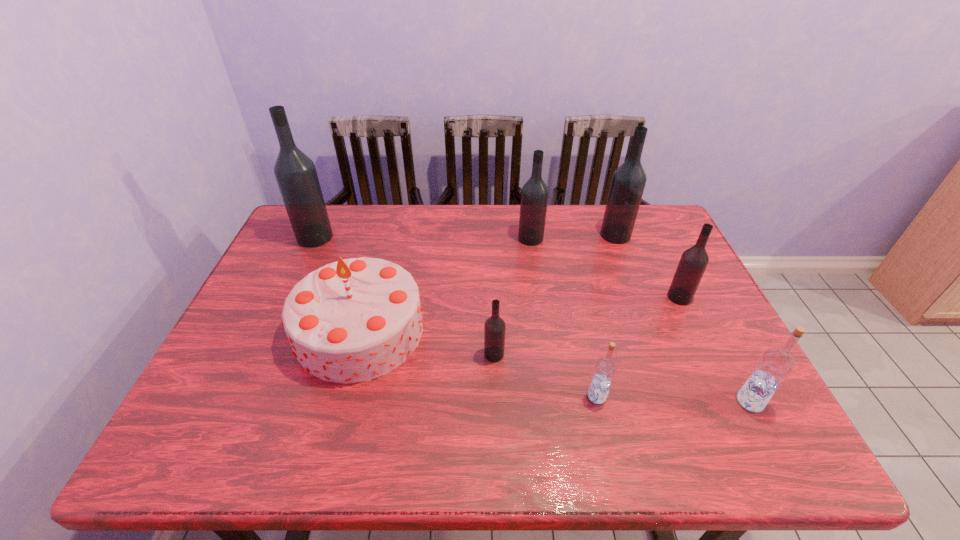
Find the location of a particular element. The image size is (960, 540). vacant space in between the fourth smallest black vodka and the leftmost black vodka is located at coordinates (466, 236).

Where is `free space between the left blue vodka and the bigger blue vodka`? free space between the left blue vodka and the bigger blue vodka is located at coordinates (674, 399).

Locate an element on the screen. vacant space that's between the third biggest black vodka and the third object from right to left is located at coordinates (573, 237).

I want to click on empty space that is in between the second nearest black vodka and the leftmost vodka, so click(x=497, y=267).

This screenshot has height=540, width=960. I want to click on unoccupied position between the left blue vodka and the rightmost black vodka, so click(x=638, y=347).

The image size is (960, 540). What are the coordinates of `empty space between the third nearest vodka and the bigger blue vodka` in the screenshot? It's located at (622, 378).

At what (x,y) coordinates should I click in order to perform the action: click on vacant point located between the birthday cake and the fourth smallest black vodka. Please return your answer as a coordinate pair (x, y). The width and height of the screenshot is (960, 540). Looking at the image, I should click on (488, 282).

Where is `empty space between the second tallest object and the leftmost object`? The image size is (960, 540). empty space between the second tallest object and the leftmost object is located at coordinates (466, 236).

Identify which object is the second closest to the right blue vodka. Please provide its 2D coordinates. Your answer should be formatted as a tuple, i.e. [(x, y)], where the tuple contains the x and y coordinates of a point satisfying the conditions above.

[(605, 368)]

Identify which object is located as the sixth nearest to the seventh shortest object. Please provide its 2D coordinates. Your answer should be formatted as a tuple, i.e. [(x, y)], where the tuple contains the x and y coordinates of a point satisfying the conditions above.

[(353, 320)]